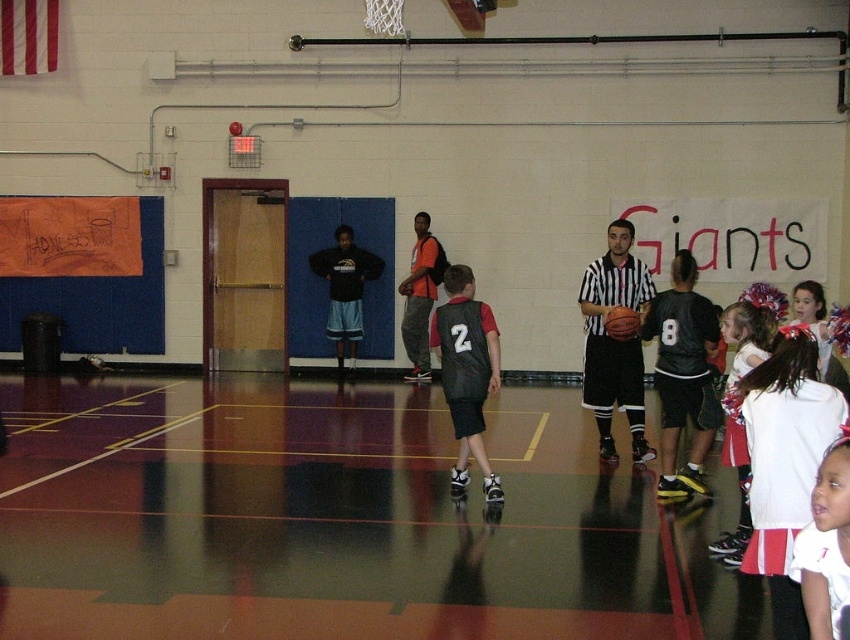
Can you confirm if white jersey at lower right is shorter than white fluffy pom-pom at upper right?

Yes, white jersey at lower right is shorter than white fluffy pom-pom at upper right.

Between white jersey at lower right and white fluffy pom-pom at upper right, which one is positioned lower?

white fluffy pom-pom at upper right is below.

Is point (805, 358) positioned after point (757, 317)?

No, it is not.

The height and width of the screenshot is (640, 850). I want to click on white jersey at lower right, so (785, 461).

Between matte black jersey at center and rubber textured basketball at center, which one has more height?

matte black jersey at center

Can you confirm if matte black jersey at center is positioned to the right of rubber textured basketball at center?

Incorrect, matte black jersey at center is not on the right side of rubber textured basketball at center.

Does point (459, 282) come behind point (629, 333)?

No, (459, 282) is closer to viewer.

Where is `matte black jersey at center`? This screenshot has height=640, width=850. matte black jersey at center is located at coordinates (468, 372).

Is white jersey at lower right closer to the viewer compared to rubber textured basketball at center?

Yes.

Does point (768, 547) come in front of point (618, 308)?

Yes, it is.

The height and width of the screenshot is (640, 850). What are the coordinates of `white jersey at lower right` in the screenshot? It's located at (785, 461).

You are a GUI agent. You are given a task and a screenshot of the screen. Output one action in this format:
    pyautogui.click(x=<x>, y=<y>)
    Task: Click on the white jersey at lower right
    This screenshot has height=640, width=850.
    Given the screenshot: What is the action you would take?
    pyautogui.click(x=785, y=461)